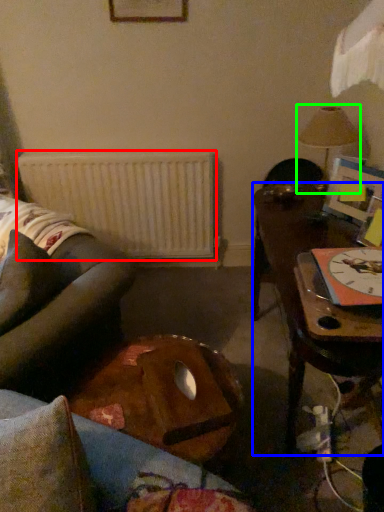
Question: Estimate the real-world distances between objects in this image. Which object is closer to radiator (highlighted by a red box), table (highlighted by a blue box) or lamp (highlighted by a green box)?

Choices:
 (A) table
 (B) lamp

Answer: (A)